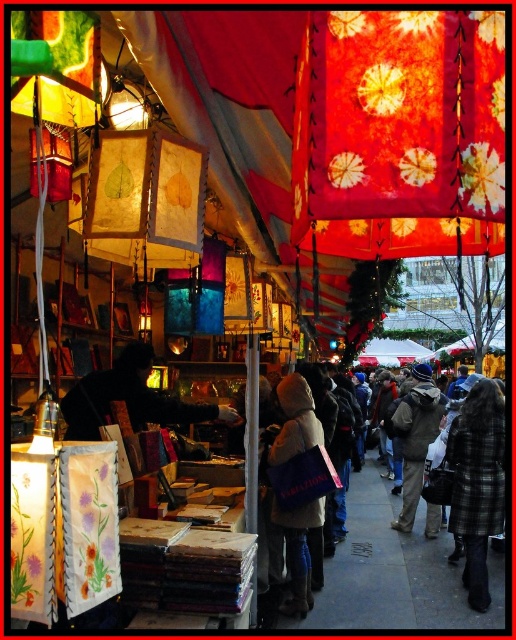
Question: Can you confirm if batik fabric lantern at upper center is positioned to the left of matte paper lantern at upper left?

Choices:
 (A) no
 (B) yes

Answer: (A)

Question: Can you confirm if batik fabric lantern at upper center is positioned above handmade paper lantern at center?

Choices:
 (A) yes
 (B) no

Answer: (B)

Question: Can you confirm if dark gray wool coat at center is wider than matte paper lantern at upper left?

Choices:
 (A) no
 (B) yes

Answer: (B)

Question: Which point is closer to the camera taking this photo?

Choices:
 (A) 475,497
 (B) 180,416

Answer: (B)

Question: Which is farther from the plaid wool coat at center-right?

Choices:
 (A) black fabric at center
 (B) batik fabric lantern at upper center

Answer: (B)

Question: Among these points, which one is farthest from the camera?

Choices:
 (A) (412, 452)
 (B) (344, 182)
 (C) (88, 404)

Answer: (A)